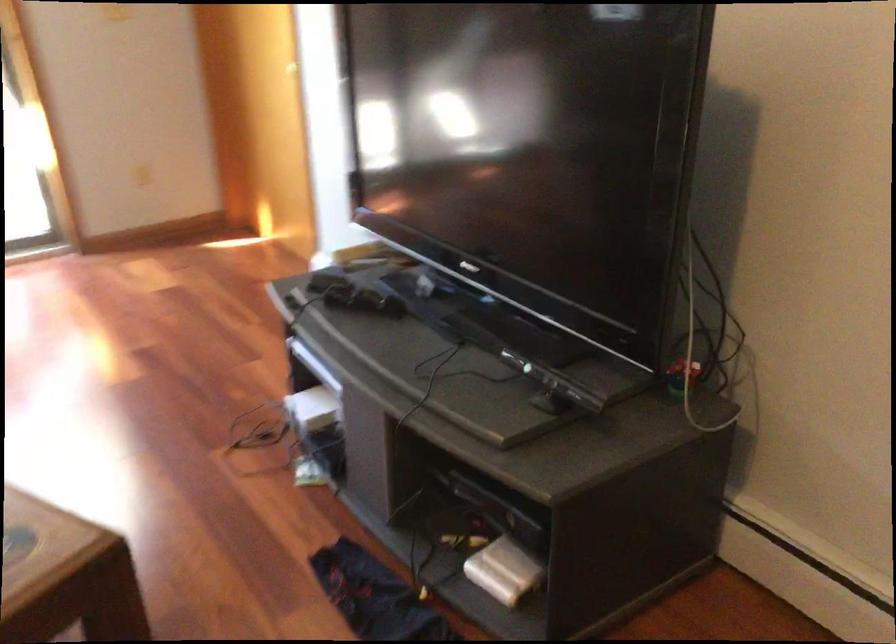
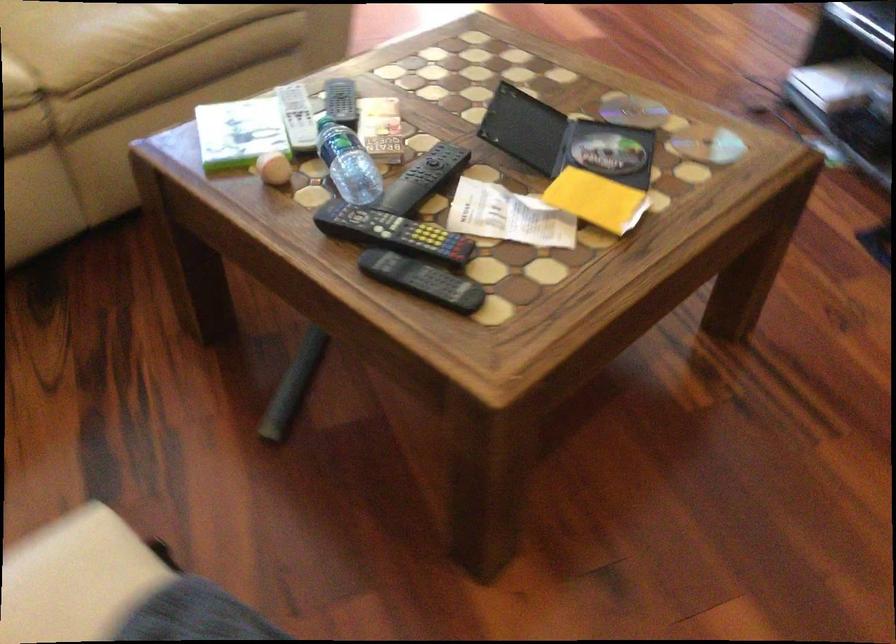
Question: The images are taken continuously from a first-person perspective. In which direction is your viewpoint rotating?

Choices:
 (A) Left
 (B) Right
 (C) Up
 (D) Down

Answer: (D)